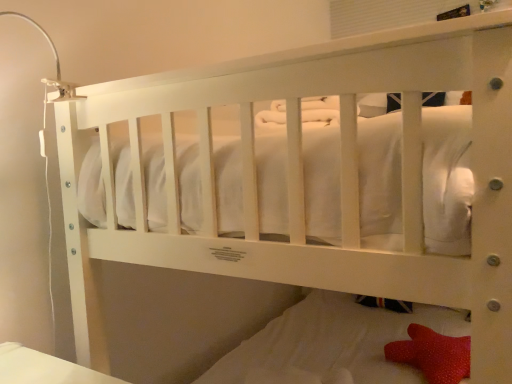
Locate an element on the screen. Image resolution: width=512 pixels, height=384 pixels. red dotted plush at lower right is located at coordinates (432, 354).

The height and width of the screenshot is (384, 512). Describe the element at coordinates (432, 354) in the screenshot. I see `red dotted plush at lower right` at that location.

Where is `red dotted plush at lower right`? The height and width of the screenshot is (384, 512). red dotted plush at lower right is located at coordinates (432, 354).